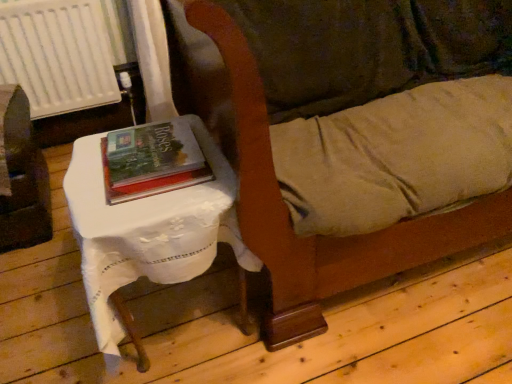
Question: Is white plastic radiator at upper left smaller than hardcover book at center?

Choices:
 (A) no
 (B) yes

Answer: (A)

Question: Is white plastic radiator at upper left completely or partially outside of hardcover book at center?

Choices:
 (A) yes
 (B) no

Answer: (A)

Question: Does white plastic radiator at upper left appear on the left side of hardcover book at center?

Choices:
 (A) no
 (B) yes

Answer: (B)

Question: Does white plastic radiator at upper left have a larger size compared to hardcover book at center?

Choices:
 (A) no
 (B) yes

Answer: (B)

Question: Is the position of white plastic radiator at upper left more distant than that of hardcover book at center?

Choices:
 (A) no
 (B) yes

Answer: (B)

Question: Which is correct: brushed metal table at left is inside hardcover book at center, or outside of it?

Choices:
 (A) inside
 (B) outside

Answer: (B)

Question: Considering the relative positions of brushed metal table at left and hardcover book at center in the image provided, is brushed metal table at left to the left or to the right of hardcover book at center?

Choices:
 (A) right
 (B) left

Answer: (B)

Question: In terms of height, does brushed metal table at left look taller or shorter compared to hardcover book at center?

Choices:
 (A) tall
 (B) short

Answer: (A)

Question: Considering the positions of brushed metal table at left and hardcover book at center in the image, is brushed metal table at left wider or thinner than hardcover book at center?

Choices:
 (A) thin
 (B) wide

Answer: (B)

Question: Does point (187, 258) appear closer or farther from the camera than point (287, 235)?

Choices:
 (A) closer
 (B) farther

Answer: (A)

Question: From the image's perspective, relative to velvet-like brown couch at center, is white cloth-covered table at left above or below?

Choices:
 (A) below
 (B) above

Answer: (A)

Question: Relative to velvet-like brown couch at center, is white cloth-covered table at left in front or behind?

Choices:
 (A) behind
 (B) front

Answer: (A)

Question: Is white cloth-covered table at left spatially inside velvet-like brown couch at center, or outside of it?

Choices:
 (A) inside
 (B) outside

Answer: (B)

Question: Visually, is velvet-like brown couch at center positioned to the left or to the right of hardcover book at center?

Choices:
 (A) right
 (B) left

Answer: (A)

Question: In terms of width, does velvet-like brown couch at center look wider or thinner when compared to hardcover book at center?

Choices:
 (A) wide
 (B) thin

Answer: (A)